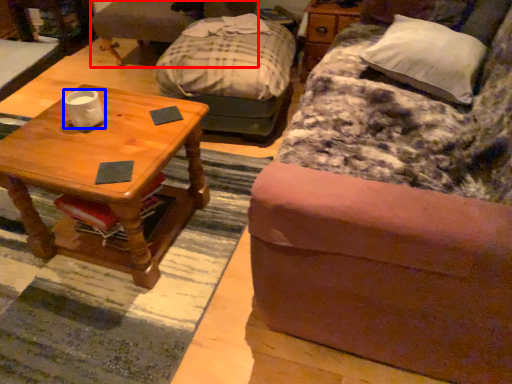
Question: Which object appears closest to the camera in this image, swivel chair (highlighted by a red box) or coffee cup (highlighted by a blue box)?

Choices:
 (A) swivel chair
 (B) coffee cup

Answer: (B)